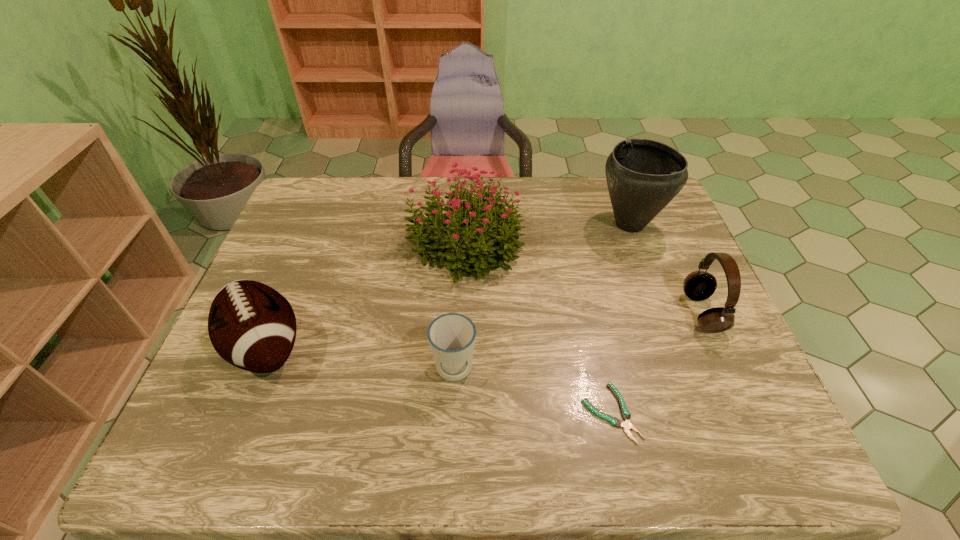
Where is `vacant space located 0.190m on the ear pads of the headset`? The width and height of the screenshot is (960, 540). vacant space located 0.190m on the ear pads of the headset is located at coordinates (612, 313).

You are a GUI agent. You are given a task and a screenshot of the screen. Output one action in this format:
    pyautogui.click(x=<x>, y=<y>)
    Task: Click on the free space located on the ear pads of the headset
    The image size is (960, 540).
    Given the screenshot: What is the action you would take?
    pyautogui.click(x=576, y=313)

What are the coordinates of `free space located 0.340m on the back of the leftmost object` in the screenshot? It's located at (316, 224).

At what (x,y) coordinates should I click in order to perform the action: click on blank space located 0.100m with a handle on the side of the second shortest object. Please return your answer as a coordinate pair (x, y). Looking at the image, I should click on (451, 438).

Identify the location of vacant space situated 0.210m on the right of the third object from right to left. (737, 413).

Identify the location of bouquet located at the far edge. The image size is (960, 540). (469, 240).

At what (x,y) coordinates should I click in order to perform the action: click on urn at the far edge. Please return your answer as a coordinate pair (x, y). Looking at the image, I should click on (643, 176).

You are a GUI agent. You are given a task and a screenshot of the screen. Output one action in this format:
    pyautogui.click(x=<x>, y=<y>)
    Task: Click on the object positioned at the near edge
    
    Given the screenshot: What is the action you would take?
    [x=626, y=415]

The image size is (960, 540). Find the location of `object positioned at the left edge`. object positioned at the left edge is located at coordinates (252, 326).

The image size is (960, 540). I want to click on urn present at the right edge, so click(x=643, y=176).